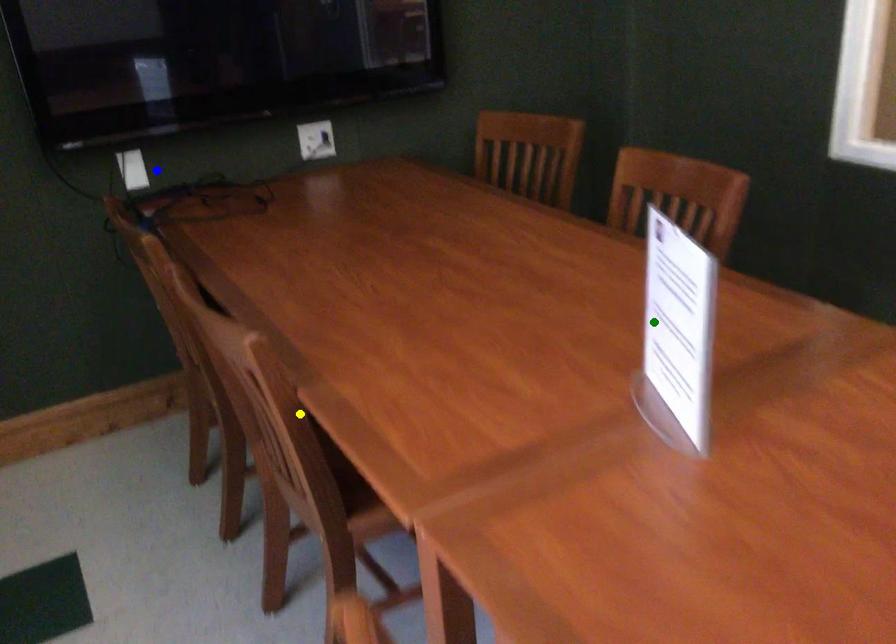
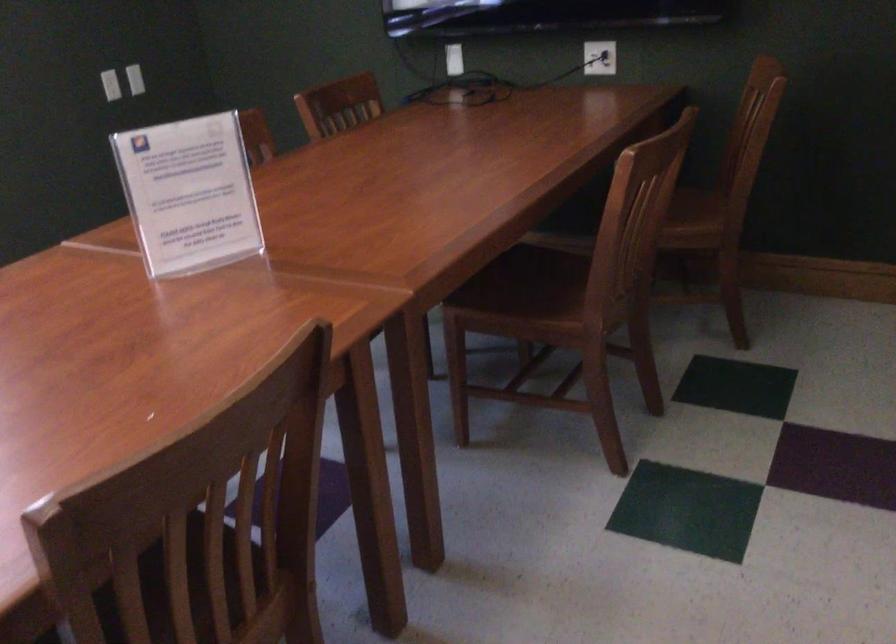
I am providing you with two images of the same scene from different viewpoints. Three points are marked in image1. Which point corresponds to a part or object that is occluded in image2?In image1, three points are marked. Which of them correspond to a part or object that is occluded in image2?Among the three points shown in image1, which one corresponds to a part or object that is no longer visible due to occlusion in image2?

Invisible in image2: yellow point.